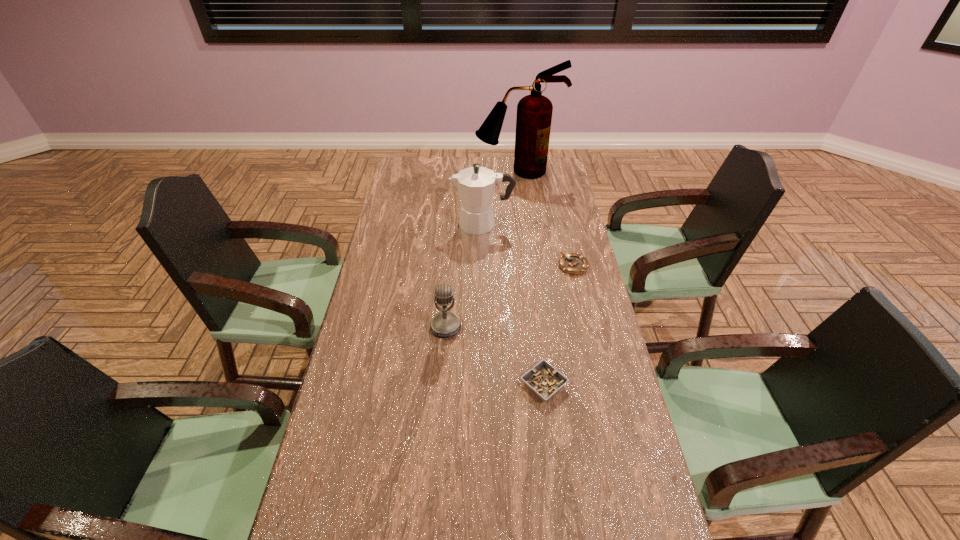
Image resolution: width=960 pixels, height=540 pixels. I want to click on free location that satisfies the following two spatial constraints: 1. at the spout of the fourth nearest object; 2. on the front-facing side of the third shortest object, so click(483, 327).